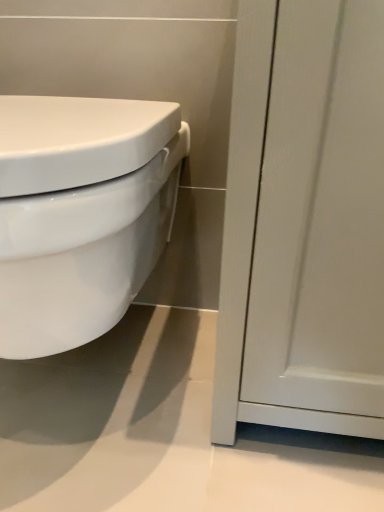
This screenshot has width=384, height=512. What do you see at coordinates (81, 213) in the screenshot?
I see `white glossy toilet at left` at bounding box center [81, 213].

This screenshot has width=384, height=512. In order to click on white glossy toilet at left in this screenshot , I will do `click(81, 213)`.

What are the coordinates of `matte white cabinet at right` in the screenshot? It's located at (304, 222).

Measure the distance between matte white cabinet at right and camera.

matte white cabinet at right and camera are 15.12 inches apart from each other.

What do you see at coordinates (304, 222) in the screenshot? I see `matte white cabinet at right` at bounding box center [304, 222].

The height and width of the screenshot is (512, 384). I want to click on white glossy toilet at left, so click(x=81, y=213).

Which object is positioned more to the right, matte white cabinet at right or white glossy toilet at left?

matte white cabinet at right.

Is matte white cabinet at right in front of or behind white glossy toilet at left in the image?

matte white cabinet at right is positioned farther from the viewer than white glossy toilet at left.

Considering the positions of point (325, 184) and point (57, 110), is point (325, 184) closer or farther from the camera than point (57, 110)?

Point (325, 184) appears to be closer to the viewer than point (57, 110).

From the image's perspective, is matte white cabinet at right above or below white glossy toilet at left?

Clearly, from the image's perspective, matte white cabinet at right is above white glossy toilet at left.

From a real-world perspective, is matte white cabinet at right physically located above or below white glossy toilet at left?

matte white cabinet at right is situated higher than white glossy toilet at left in the real world.

Considering the sizes of matte white cabinet at right and white glossy toilet at left in the image, is matte white cabinet at right wider or thinner than white glossy toilet at left?

Considering their sizes, matte white cabinet at right looks slimmer than white glossy toilet at left.

In terms of height, does matte white cabinet at right look taller or shorter compared to white glossy toilet at left?

In the image, matte white cabinet at right appears to be taller than white glossy toilet at left.

Which of these two, matte white cabinet at right or white glossy toilet at left, is bigger?

With larger size is white glossy toilet at left.

Is matte white cabinet at right not within white glossy toilet at left?

Indeed, matte white cabinet at right is completely outside white glossy toilet at left.

From the picture: Is matte white cabinet at right beside white glossy toilet at left?

No, matte white cabinet at right is not with white glossy toilet at left.

Is matte white cabinet at right oriented towards white glossy toilet at left?

No.

What's the angular difference between matte white cabinet at right and white glossy toilet at left's facing directions?

The facing directions of matte white cabinet at right and white glossy toilet at left are 0.404 degrees apart.

Looking at this image, how distant is matte white cabinet at right from white glossy toilet at left?

8.61 inches.

You are a GUI agent. You are given a task and a screenshot of the screen. Output one action in this format:
    pyautogui.click(x=<x>, y=<y>)
    Task: Click on the screen door behind the white glossy toilet at left
    
    Given the screenshot: What is the action you would take?
    pyautogui.click(x=304, y=222)

Considering the relative positions of white glossy toilet at left and matte white cabinet at right in the image provided, is white glossy toilet at left to the right of matte white cabinet at right from the viewer's perspective?

Incorrect, white glossy toilet at left is not on the right side of matte white cabinet at right.

From the picture: Which object is further away from the camera taking this photo, white glossy toilet at left or matte white cabinet at right?

matte white cabinet at right is behind.

Considering the points (35, 264) and (245, 202), which point is in front, point (35, 264) or point (245, 202)?

The point (35, 264) is closer.

From the image's perspective, is white glossy toilet at left under matte white cabinet at right?

Yes, from the image's perspective, white glossy toilet at left is below matte white cabinet at right.

From a real-world perspective, is white glossy toilet at left physically located above or below matte white cabinet at right?

Clearly, from a real-world perspective, white glossy toilet at left is below matte white cabinet at right.

Is white glossy toilet at left wider or thinner than matte white cabinet at right?

white glossy toilet at left is wider than matte white cabinet at right.

Is white glossy toilet at left taller or shorter than matte white cabinet at right?

white glossy toilet at left is shorter than matte white cabinet at right.

Considering the relative sizes of white glossy toilet at left and matte white cabinet at right in the image provided, is white glossy toilet at left bigger than matte white cabinet at right?

Yes.

Do you think white glossy toilet at left is within matte white cabinet at right, or outside of it?

white glossy toilet at left is not enclosed by matte white cabinet at right.

Does white glossy toilet at left touch matte white cabinet at right?

white glossy toilet at left is not next to matte white cabinet at right, and they're not touching.

Is white glossy toilet at left facing towards matte white cabinet at right?

No, white glossy toilet at left does not turn towards matte white cabinet at right.

How different are the orientations of white glossy toilet at left and matte white cabinet at right in degrees?

The facing directions of white glossy toilet at left and matte white cabinet at right are 0.404 degrees apart.

Based on the photo, how distant is white glossy toilet at left from matte white cabinet at right?

white glossy toilet at left is 8.61 inches away from matte white cabinet at right.

Locate an element on the screen. The image size is (384, 512). toilet on the left of the matte white cabinet at right is located at coordinates (81, 213).

You are a GUI agent. You are given a task and a screenshot of the screen. Output one action in this format:
    pyautogui.click(x=<x>, y=<y>)
    Task: Click on the screen door on the right of white glossy toilet at left
    The width and height of the screenshot is (384, 512).
    Given the screenshot: What is the action you would take?
    pyautogui.click(x=304, y=222)

Find the location of a particular element. toilet below the matte white cabinet at right (from a real-world perspective) is located at coordinates (81, 213).